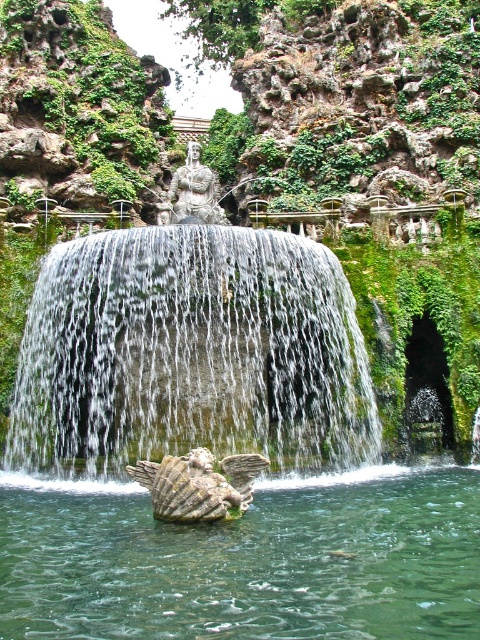
Does white textured water at center have a greater height compared to stone winged creature at center?

Correct, white textured water at center is much taller as stone winged creature at center.

Consider the image. Who is more distant from viewer, [19,440] or [180,516]?

The point [19,440] is more distant.

Image resolution: width=480 pixels, height=640 pixels. Describe the element at coordinates (191, 355) in the screenshot. I see `white textured water at center` at that location.

Identify the location of white textured water at center. (191, 355).

Can you confirm if white textured water at center is thinner than clear stone water at center?

Yes.

Locate an element on the screen. The width and height of the screenshot is (480, 640). white textured water at center is located at coordinates (191, 355).

Does clear stone water at center have a greater width compared to stone winged creature at center?

Indeed, clear stone water at center has a greater width compared to stone winged creature at center.

Between point (181, 593) and point (224, 483), which one is positioned in front?

Point (181, 593) is more forward.

The width and height of the screenshot is (480, 640). In order to click on clear stone water at center in this screenshot , I will do `click(245, 561)`.